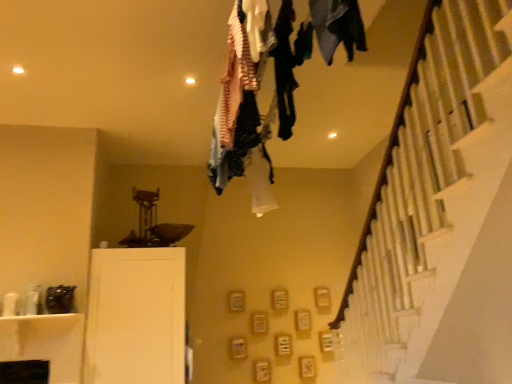
Question: Should I look upward or downward to see white matte cabinet at lower left?

Choices:
 (A) down
 (B) up

Answer: (A)

Question: Can you confirm if dark blue fabric at upper center is thinner than white matte cabinet at lower left?

Choices:
 (A) yes
 (B) no

Answer: (A)

Question: Is dark blue fabric at upper center to the right of white matte cabinet at lower left from the viewer's perspective?

Choices:
 (A) no
 (B) yes

Answer: (B)

Question: Is dark blue fabric at upper center at the left side of white matte cabinet at lower left?

Choices:
 (A) yes
 (B) no

Answer: (B)

Question: From the image's perspective, is dark blue fabric at upper center over white matte cabinet at lower left?

Choices:
 (A) yes
 (B) no

Answer: (A)

Question: Is white matte cabinet at lower left a part of dark blue fabric at upper center?

Choices:
 (A) no
 (B) yes

Answer: (A)

Question: Is dark blue fabric at upper center positioned behind white matte cabinet at lower left?

Choices:
 (A) yes
 (B) no

Answer: (B)

Question: Is white matte cabinet at lower left next to dark blue fabric at upper center and touching it?

Choices:
 (A) no
 (B) yes

Answer: (A)

Question: Is white matte cabinet at lower left positioned behind dark blue fabric at upper center?

Choices:
 (A) no
 (B) yes

Answer: (B)

Question: Is dark blue fabric at upper center a part of white matte cabinet at lower left?

Choices:
 (A) no
 (B) yes

Answer: (A)

Question: Is white matte cabinet at lower left shorter than dark blue fabric at upper center?

Choices:
 (A) yes
 (B) no

Answer: (B)

Question: From a real-world perspective, is white matte cabinet at lower left on top of dark blue fabric at upper center?

Choices:
 (A) no
 (B) yes

Answer: (A)

Question: Is white matte cabinet at lower left to the right of dark blue fabric at upper center from the viewer's perspective?

Choices:
 (A) yes
 (B) no

Answer: (B)

Question: Choose the correct answer: Is white matte cabinet at lower left inside dark blue fabric at upper center or outside it?

Choices:
 (A) inside
 (B) outside

Answer: (B)